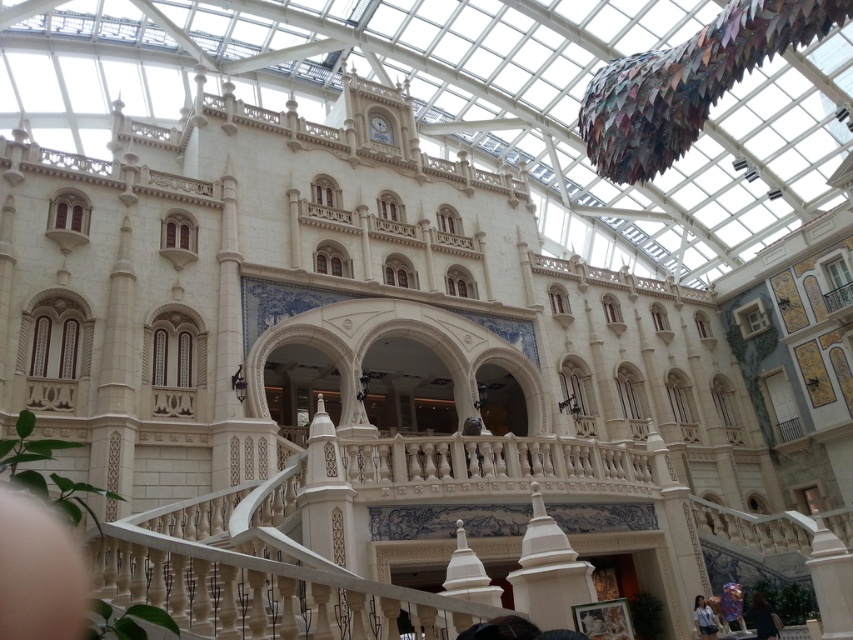
Can you confirm if dark brown leather jacket at lower right is shorter than light blue denim shirt at lower right?

Yes.

Consider the image. Can you confirm if dark brown leather jacket at lower right is positioned to the right of light blue denim shirt at lower right?

Correct, you'll find dark brown leather jacket at lower right to the right of light blue denim shirt at lower right.

Measure the distance between dark brown leather jacket at lower right and camera.

dark brown leather jacket at lower right is 143.64 feet from camera.

Where is `dark brown leather jacket at lower right`? dark brown leather jacket at lower right is located at coordinates (762, 618).